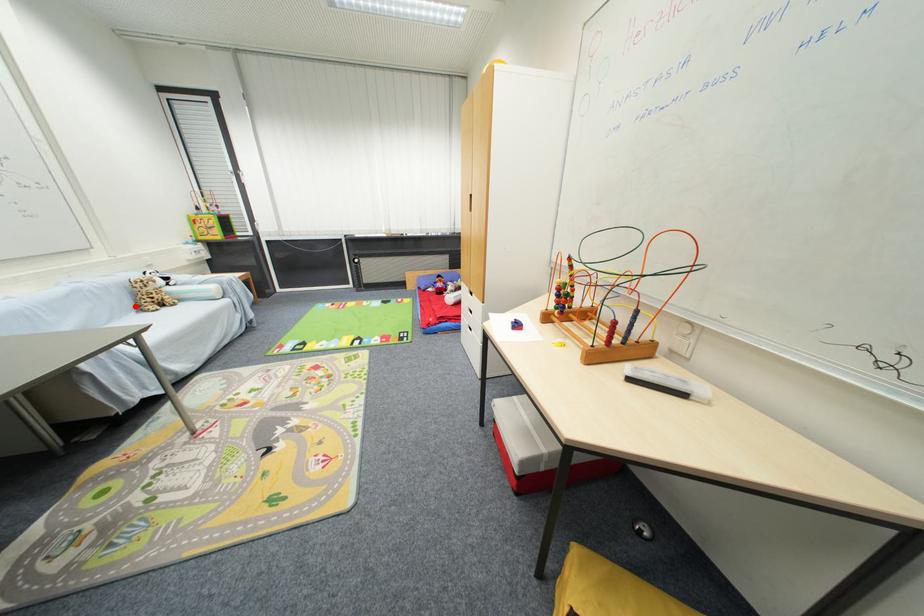
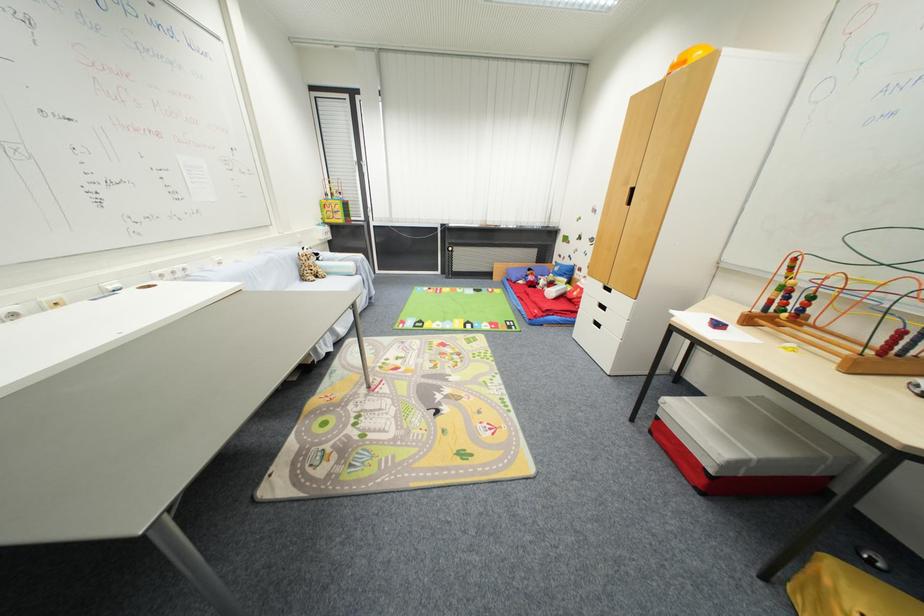
Find the pixel in the second image that matches the highlighted location in the first image.

(300, 276)